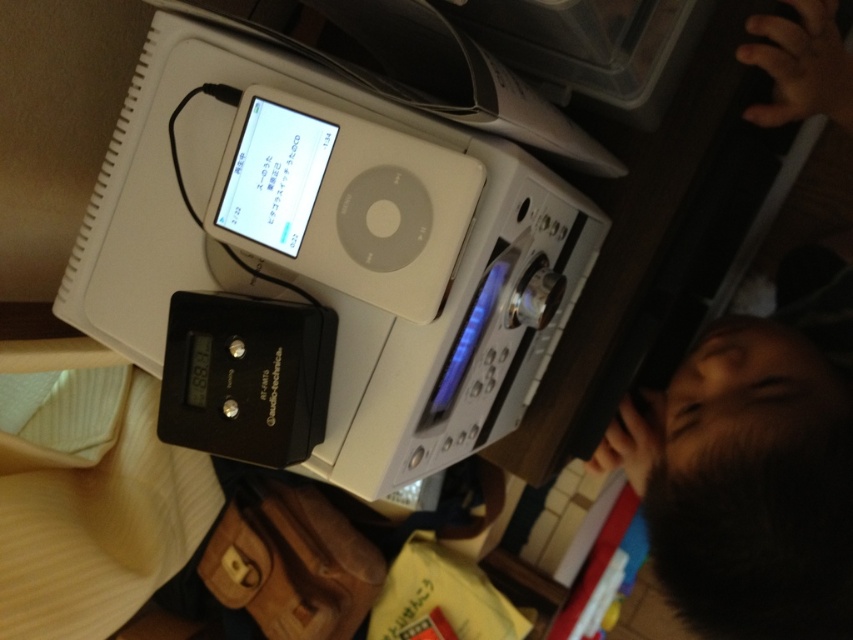
You are organizing a desk and want to place the white plastic ipod at upper center and the black hair at upper right. Which object should you place first if you need to handle the smaller item first?

The black hair at upper right should be placed first because it is smaller than the white plastic ipod at upper center.

You are looking at the cluttered desk with the white portable stereo system at the center and the black audio interface to its left. There are two points marked on the desk. Which of the two points, point (236, 195) or point (426, 266), is closer to you?

Point (236, 195) is closer to you because it is further to the viewer than point (426, 266).